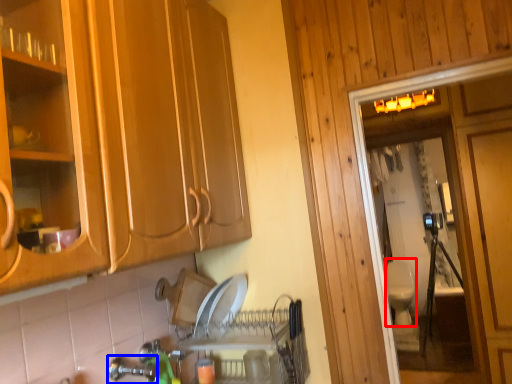
Question: Which point is closer to the camera, toilet bowl (highlighted by a red box) or faucet (highlighted by a blue box)?

Choices:
 (A) toilet bowl
 (B) faucet

Answer: (B)